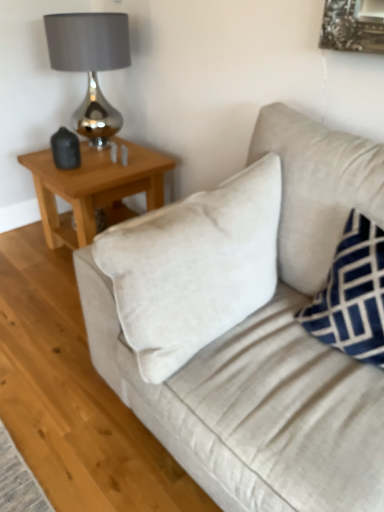
Measure the distance between point [361,330] and camera.

The depth of point [361,330] is 3.81 feet.

You are a GUI agent. You are given a task and a screenshot of the screen. Output one action in this format:
    pyautogui.click(x=<x>, y=<y>)
    Task: Click on the blue velvet pillow at right
    
    Given the screenshot: What is the action you would take?
    pyautogui.click(x=352, y=295)

Is blue velvet pillow at right turned away from light brown wooden table at upper left?

Result: No, light brown wooden table at upper left is not at the back of blue velvet pillow at right.

How far apart are blue velvet pillow at right and light brown wooden table at upper left?

A distance of 1.31 meters exists between blue velvet pillow at right and light brown wooden table at upper left.

Is the position of blue velvet pillow at right more distant than that of light brown wooden table at upper left?

No, it is not.

From a real-world perspective, relative to light brown wooden table at upper left, is blue velvet pillow at right vertically above or below?

blue velvet pillow at right is above light brown wooden table at upper left.

The image size is (384, 512). I want to click on table behind the beige fabric couch at center, so click(94, 188).

Considering their positions, is light brown wooden table at upper left located in front of or behind beige fabric couch at center?

light brown wooden table at upper left is behind beige fabric couch at center.

Are light brown wooden table at upper left and beige fabric couch at center making contact?

They are not placed beside each other.

Is blue velvet pillow at right positioned beyond the bounds of beige fabric couch at center?

Actually, blue velvet pillow at right is within beige fabric couch at center.

From the image's perspective, relative to beige fabric couch at center, is blue velvet pillow at right above or below?

Based on their image positions, blue velvet pillow at right is located above beige fabric couch at center.

Who is more distant, blue velvet pillow at right or beige fabric couch at center?

blue velvet pillow at right is further from the camera.

Does blue velvet pillow at right touch beige fabric couch at center?

No.

From the image's perspective, between light brown wooden table at upper left and blue velvet pillow at right, which one is located above?

light brown wooden table at upper left appears higher in the image.

How many degrees apart are the facing directions of light brown wooden table at upper left and blue velvet pillow at right?

89.5 degrees.

Would you consider light brown wooden table at upper left to be distant from blue velvet pillow at right?

Yes, light brown wooden table at upper left and blue velvet pillow at right are located far from each other.

From a real-world perspective, is shiny metallic lamp at upper left on top of blue velvet pillow at right?

Indeed, from a real-world perspective, shiny metallic lamp at upper left stands above blue velvet pillow at right.

Considering the positions of point (98, 110) and point (334, 323), is point (98, 110) closer or farther from the camera than point (334, 323)?

Point (98, 110) is farther from the camera than point (334, 323).

Does shiny metallic lamp at upper left appear on the left side of blue velvet pillow at right?

Yes, shiny metallic lamp at upper left is to the left of blue velvet pillow at right.

Would you say blue velvet pillow at right is part of shiny metallic lamp at upper left's contents?

No, blue velvet pillow at right is not inside shiny metallic lamp at upper left.

Identify the location of table lamp on the left side of light brown wooden table at upper left. Image resolution: width=384 pixels, height=512 pixels. (90, 65).

Considering the relative sizes of shiny metallic lamp at upper left and light brown wooden table at upper left in the image provided, is shiny metallic lamp at upper left bigger than light brown wooden table at upper left?

No, shiny metallic lamp at upper left is not bigger than light brown wooden table at upper left.

Is shiny metallic lamp at upper left to the left of light brown wooden table at upper left from the viewer's perspective?

Yes.

Is point (98, 27) in front of point (108, 161)?

That is True.

From a real-world perspective, is light brown wooden table at upper left physically above shiny metallic lamp at upper left?

No, from a real-world perspective, light brown wooden table at upper left is not above shiny metallic lamp at upper left.

Is light brown wooden table at upper left oriented towards shiny metallic lamp at upper left?

No, light brown wooden table at upper left is not facing towards shiny metallic lamp at upper left.

Is light brown wooden table at upper left placed right next to shiny metallic lamp at upper left?

No, light brown wooden table at upper left is not touching shiny metallic lamp at upper left.

Locate an element on the screen. This screenshot has width=384, height=512. pillow in front of the light brown wooden table at upper left is located at coordinates (352, 295).

The image size is (384, 512). I want to click on studio couch below the light brown wooden table at upper left (from the image's perspective), so click(x=271, y=351).

From the image, which object appears to be nearer to beige fabric couch at center, blue velvet pillow at right or shiny metallic lamp at upper left?

Among the two, blue velvet pillow at right is located nearer to beige fabric couch at center.

Considering their positions, is light brown wooden table at upper left positioned closer to beige fabric couch at center than blue velvet pillow at right?

Among the two, blue velvet pillow at right is located nearer to beige fabric couch at center.

Based on their spatial positions, is light brown wooden table at upper left or beige fabric couch at center closer to shiny metallic lamp at upper left?

light brown wooden table at upper left lies closer to shiny metallic lamp at upper left than the other object.

Considering their positions, is beige fabric couch at center positioned closer to shiny metallic lamp at upper left than light brown wooden table at upper left?

light brown wooden table at upper left is closer to shiny metallic lamp at upper left.

Estimate the real-world distances between objects in this image. Which object is further from beige fabric couch at center, shiny metallic lamp at upper left or light brown wooden table at upper left?

The object further to beige fabric couch at center is shiny metallic lamp at upper left.

Which object lies further to the anchor point shiny metallic lamp at upper left, light brown wooden table at upper left or blue velvet pillow at right?

blue velvet pillow at right lies further to shiny metallic lamp at upper left than the other object.

Based on their spatial positions, is shiny metallic lamp at upper left or light brown wooden table at upper left further from blue velvet pillow at right?

Among the two, shiny metallic lamp at upper left is located further to blue velvet pillow at right.

When comparing their distances from light brown wooden table at upper left, does blue velvet pillow at right or beige fabric couch at center seem closer?

The object closer to light brown wooden table at upper left is beige fabric couch at center.

The image size is (384, 512). Identify the location of table lamp positioned between blue velvet pillow at right and light brown wooden table at upper left from near to far. (90, 65).

Image resolution: width=384 pixels, height=512 pixels. I want to click on pillow located between beige fabric couch at center and shiny metallic lamp at upper left in the depth direction, so click(352, 295).

Image resolution: width=384 pixels, height=512 pixels. What are the coordinates of `pillow between beige fabric couch at center and light brown wooden table at upper left in the front-back direction` in the screenshot? It's located at (352, 295).

The height and width of the screenshot is (512, 384). I want to click on table lamp between beige fabric couch at center and light brown wooden table at upper left in the front-back direction, so coord(90,65).